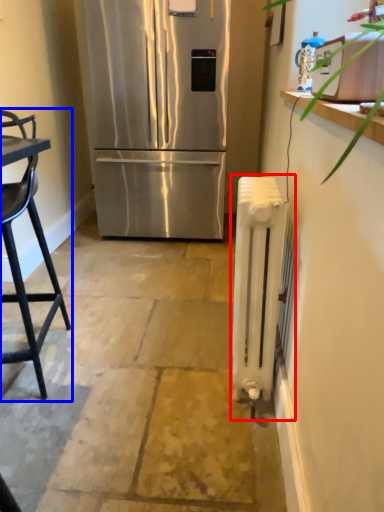
Question: Which of the following is the closest to the observer, radiator (highlighted by a red box) or chair (highlighted by a blue box)?

Choices:
 (A) radiator
 (B) chair

Answer: (B)